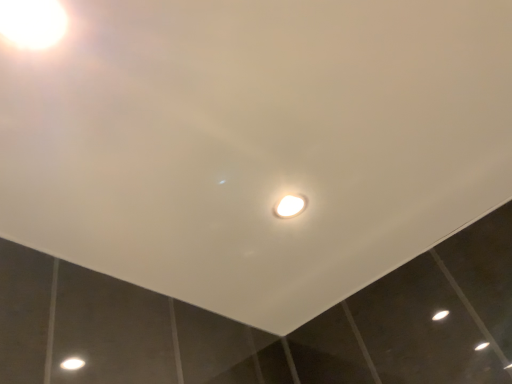
What is the approximate height of white glossy light fixture at upper left?

0.51 inches.

What do you see at coordinates (32, 22) in the screenshot? The image size is (512, 384). I see `white glossy light fixture at upper left` at bounding box center [32, 22].

You are a GUI agent. You are given a task and a screenshot of the screen. Output one action in this format:
    pyautogui.click(x=<x>, y=<y>)
    Task: Click on the white glossy light fixture at upper left
    This screenshot has width=512, height=384.
    Given the screenshot: What is the action you would take?
    pyautogui.click(x=32, y=22)

I want to click on white glossy light fixture at upper left, so click(x=32, y=22).